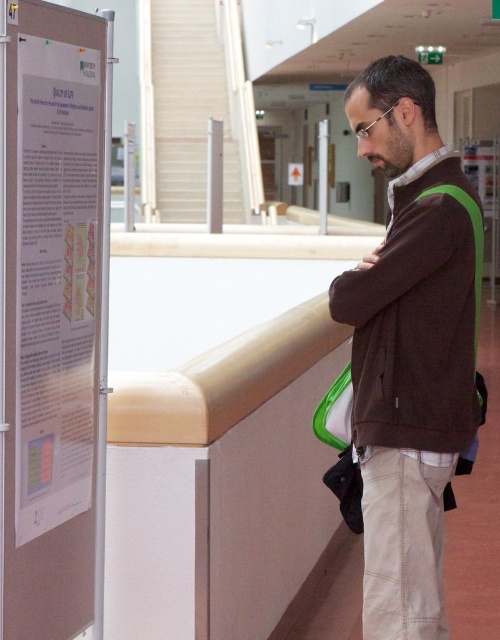
Is brown fleece jacket at center further to the viewer compared to white paper poster at left?

Yes, brown fleece jacket at center is behind white paper poster at left.

Between point (396, 74) and point (57, 301), which one is positioned behind?

The point (396, 74) is behind.

At what (x,y) coordinates should I click in order to perform the action: click on brown fleece jacket at center. Please return your answer as a coordinate pair (x, y). This screenshot has height=640, width=500. Looking at the image, I should click on (409, 348).